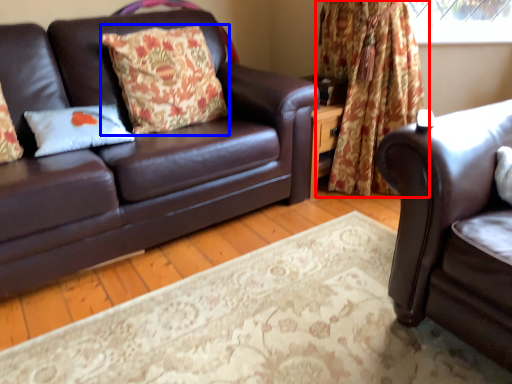
Question: Which object is further to the camera taking this photo, curtain (highlighted by a red box) or pillow (highlighted by a blue box)?

Choices:
 (A) curtain
 (B) pillow

Answer: (A)